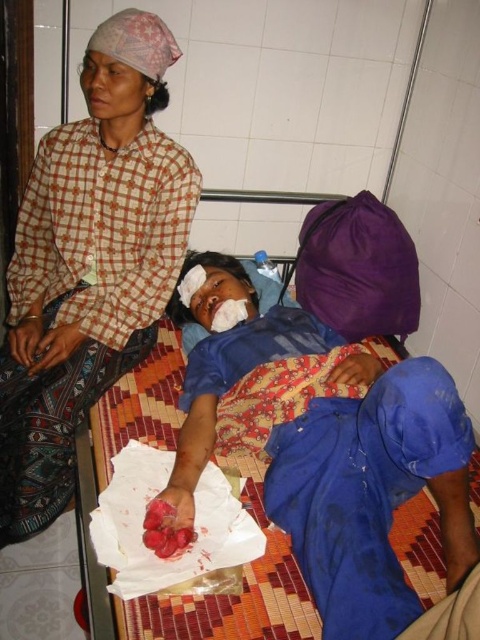
Can you confirm if blue fabric bandage at center is thinner than checkered fabric headscarf at upper left?

No, blue fabric bandage at center is not thinner than checkered fabric headscarf at upper left.

Locate an element on the screen. The width and height of the screenshot is (480, 640). blue fabric bandage at center is located at coordinates (370, 486).